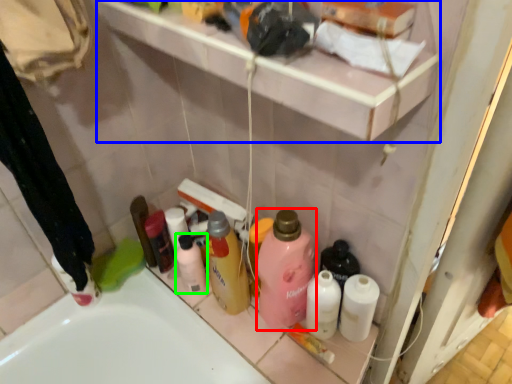
Question: Which object is positioned farthest from cleaning product (highlighted by a red box)? Select from shelf (highlighted by a blue box) and toiletry (highlighted by a green box).

Choices:
 (A) shelf
 (B) toiletry

Answer: (A)